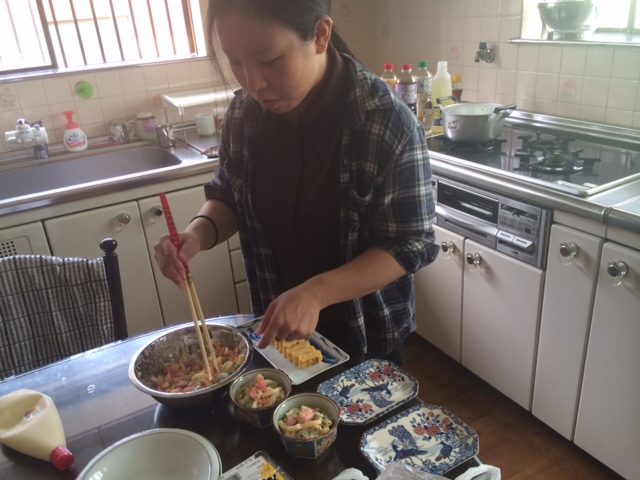
Identify the location of table. The image size is (640, 480). (111, 406).